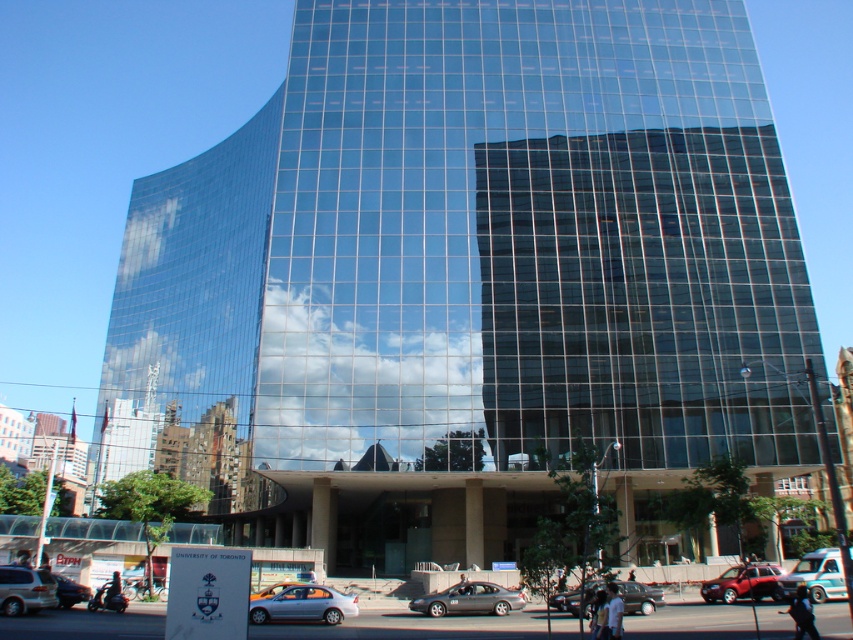
Who is shorter, teal glossy van at center or shiny metallic car at lower left?

shiny metallic car at lower left is shorter.

Which is more to the right, teal glossy van at center or shiny metallic car at lower left?

teal glossy van at center is more to the right.

Does point (805, 568) come closer to viewer compared to point (77, 589)?

No.

Locate an element on the screen. The height and width of the screenshot is (640, 853). teal glossy van at center is located at coordinates (816, 576).

Who is positioned more to the left, silver metallic sedan at center or silver metallic van at lower left?

From the viewer's perspective, silver metallic van at lower left appears more on the left side.

Is point (322, 618) positioned before point (1, 592)?

No, (322, 618) is further to viewer.

Locate an element on the screen. The width and height of the screenshot is (853, 640). silver metallic sedan at center is located at coordinates (305, 605).

Who is more forward, (827, 580) or (9, 604)?

Point (9, 604)

This screenshot has width=853, height=640. What do you see at coordinates (816, 576) in the screenshot? I see `teal glossy van at center` at bounding box center [816, 576].

Image resolution: width=853 pixels, height=640 pixels. In order to click on teal glossy van at center in this screenshot , I will do `click(816, 576)`.